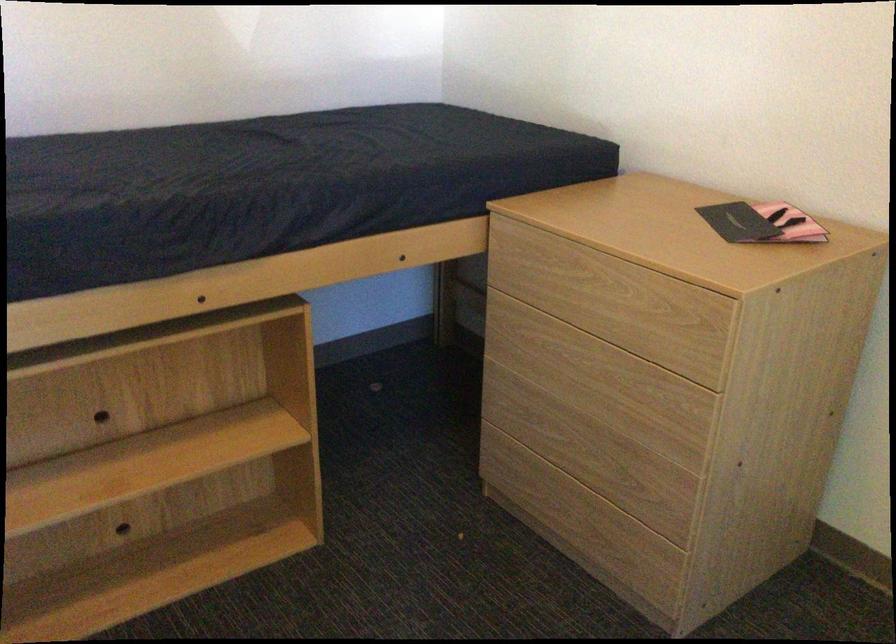
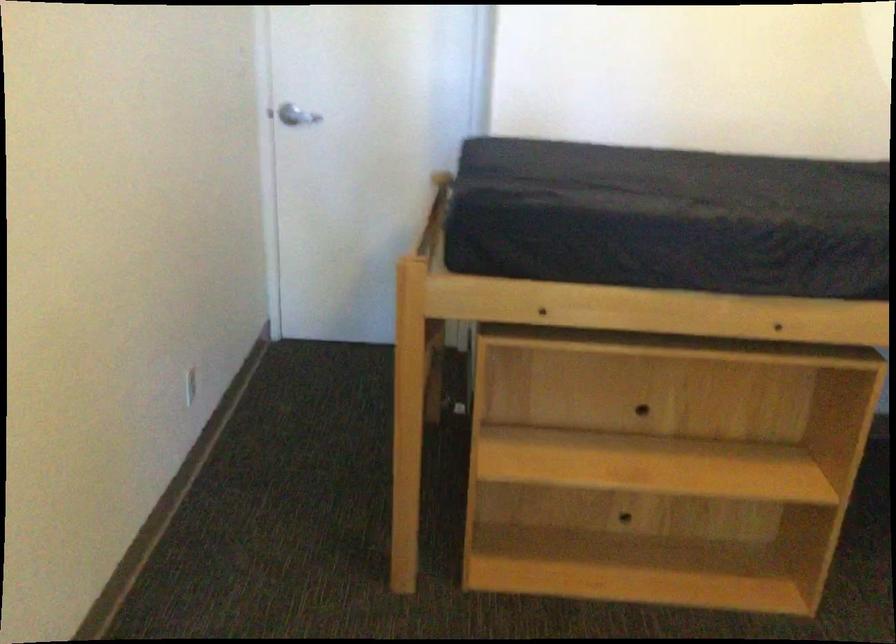
Where in the second image is the point corresponding to the point at 126,527 from the first image?

(623, 518)